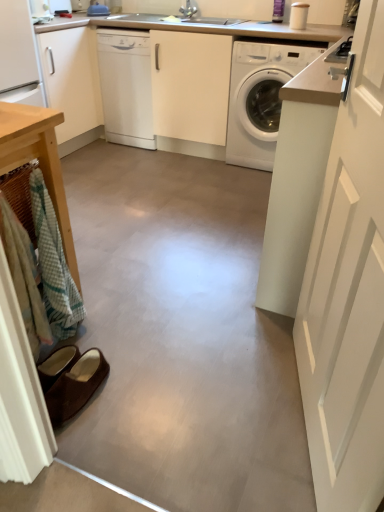
Question: Does white matte cabinet at upper left have a lesser width compared to brown suede slippers at lower left?

Choices:
 (A) no
 (B) yes

Answer: (A)

Question: Is white matte cabinet at upper left oriented away from brown suede slippers at lower left?

Choices:
 (A) no
 (B) yes

Answer: (A)

Question: Is white matte cabinet at upper left to the left of brown suede slippers at lower left from the viewer's perspective?

Choices:
 (A) no
 (B) yes

Answer: (B)

Question: Is white matte cabinet at upper left positioned behind brown suede slippers at lower left?

Choices:
 (A) yes
 (B) no

Answer: (A)

Question: Are white matte cabinet at upper left and brown suede slippers at lower left making contact?

Choices:
 (A) no
 (B) yes

Answer: (A)

Question: Is white glossy dishwasher at center inside the boundaries of white glossy washing machine at center, or outside?

Choices:
 (A) outside
 (B) inside

Answer: (A)

Question: Is white glossy dishwasher at center wider or thinner than white glossy washing machine at center?

Choices:
 (A) thin
 (B) wide

Answer: (A)

Question: Does point (127, 51) appear closer or farther from the camera than point (256, 74)?

Choices:
 (A) farther
 (B) closer

Answer: (A)

Question: Based on their sizes in the image, would you say white glossy dishwasher at center is bigger or smaller than white glossy washing machine at center?

Choices:
 (A) small
 (B) big

Answer: (A)

Question: Considering the positions of point (144, 86) and point (200, 219), is point (144, 86) closer or farther from the camera than point (200, 219)?

Choices:
 (A) farther
 (B) closer

Answer: (A)

Question: Which is correct: white glossy dishwasher at center is inside smooth concrete floor at center, or outside of it?

Choices:
 (A) inside
 (B) outside

Answer: (B)

Question: From the image's perspective, is white glossy dishwasher at center positioned above or below smooth concrete floor at center?

Choices:
 (A) above
 (B) below

Answer: (A)

Question: From their relative heights in the image, would you say white glossy dishwasher at center is taller or shorter than smooth concrete floor at center?

Choices:
 (A) short
 (B) tall

Answer: (B)

Question: From the image's perspective, is white glossy counter top at upper center positioned above or below smooth concrete floor at center?

Choices:
 (A) below
 (B) above

Answer: (B)

Question: Considering the relative positions of white glossy counter top at upper center and smooth concrete floor at center in the image provided, is white glossy counter top at upper center to the left or to the right of smooth concrete floor at center?

Choices:
 (A) left
 (B) right

Answer: (B)